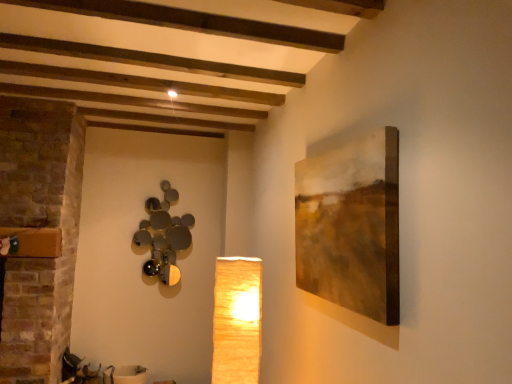
What do you see at coordinates (351, 226) in the screenshot?
I see `matte brown canvas at right` at bounding box center [351, 226].

Locate an element on the screen. metallic reflective spheres at upper left, positioned as the 1th lamp in left-to-right order is located at coordinates (164, 236).

Locate an element on the screen. matte yellow paper lampshade at center, the 1th lamp viewed from the right is located at coordinates (237, 320).

Does matte yellow paper lampshade at center, positioned as the 1th lamp in front-to-back order, have a lesser width compared to metallic reflective spheres at upper left, which ranks as the 1th lamp in back-to-front order?

No, matte yellow paper lampshade at center, positioned as the 1th lamp in front-to-back order, is not thinner than metallic reflective spheres at upper left, which ranks as the 1th lamp in back-to-front order.

Consider the image. Is matte yellow paper lampshade at center, the 1th lamp viewed from the right, facing towards metallic reflective spheres at upper left, which is counted as the second lamp, starting from the front?

No.

Between point (231, 308) and point (176, 216), which one is positioned in front?

Point (231, 308)

How many degrees apart are the facing directions of matte yellow paper lampshade at center, positioned as the 1th lamp in front-to-back order, and metallic reflective spheres at upper left, which ranks as the 1th lamp in back-to-front order?

92 degrees separate the facing orientations of matte yellow paper lampshade at center, positioned as the 1th lamp in front-to-back order, and metallic reflective spheres at upper left, which ranks as the 1th lamp in back-to-front order.

Does matte yellow paper lampshade at center, the second lamp viewed from the left, have a smaller size compared to matte brown canvas at right?

No.

The height and width of the screenshot is (384, 512). I want to click on picture frame lying in front of the matte yellow paper lampshade at center, the second lamp viewed from the left, so click(351, 226).

Is matte yellow paper lampshade at center, the second lamp viewed from the left, at the right side of matte brown canvas at right?

In fact, matte yellow paper lampshade at center, the second lamp viewed from the left, is to the left of matte brown canvas at right.

Based on their sizes in the image, would you say metallic reflective spheres at upper left, which ranks as the 1th lamp in back-to-front order, is bigger or smaller than matte brown canvas at right?

Considering their sizes, metallic reflective spheres at upper left, which ranks as the 1th lamp in back-to-front order, takes up less space than matte brown canvas at right.

Does metallic reflective spheres at upper left, which ranks as the 1th lamp in back-to-front order, appear on the right side of matte brown canvas at right?

In fact, metallic reflective spheres at upper left, which ranks as the 1th lamp in back-to-front order, is to the left of matte brown canvas at right.

Is metallic reflective spheres at upper left, positioned as the 1th lamp in left-to-right order, beside matte brown canvas at right?

They are not placed beside each other.

Is metallic reflective spheres at upper left, which is counted as the second lamp, starting from the front, taller than matte brown canvas at right?

Yes, metallic reflective spheres at upper left, which is counted as the second lamp, starting from the front, is taller than matte brown canvas at right.

In the scene shown: Is matte yellow paper lampshade at center, the second lamp viewed from the left, inside metallic reflective spheres at upper left, positioned as the 1th lamp in left-to-right order?

No, matte yellow paper lampshade at center, the second lamp viewed from the left, is not inside metallic reflective spheres at upper left, positioned as the 1th lamp in left-to-right order.

Between metallic reflective spheres at upper left, positioned as the 1th lamp in left-to-right order, and matte yellow paper lampshade at center, positioned as the 1th lamp in front-to-back order, which one has more height?

With more height is metallic reflective spheres at upper left, positioned as the 1th lamp in left-to-right order.

From the image's perspective, is metallic reflective spheres at upper left, marked as the second lamp in a right-to-left arrangement, located above or below matte yellow paper lampshade at center, the 1th lamp viewed from the right?

metallic reflective spheres at upper left, marked as the second lamp in a right-to-left arrangement, is situated higher than matte yellow paper lampshade at center, the 1th lamp viewed from the right, in the image.

Is matte brown canvas at right oriented towards metallic reflective spheres at upper left, which ranks as the 1th lamp in back-to-front order?

No, matte brown canvas at right does not turn towards metallic reflective spheres at upper left, which ranks as the 1th lamp in back-to-front order.

Measure the distance between matte brown canvas at right and metallic reflective spheres at upper left, which ranks as the 1th lamp in back-to-front order.

They are 7.93 feet apart.

Which is further, (309, 207) or (191, 219)?

The point (191, 219) is farther from the camera.

Would you say matte brown canvas at right is outside metallic reflective spheres at upper left, positioned as the 1th lamp in left-to-right order?

Yes, matte brown canvas at right is outside of metallic reflective spheres at upper left, positioned as the 1th lamp in left-to-right order.

Is matte brown canvas at right looking in the opposite direction of matte yellow paper lampshade at center, the 1th lamp viewed from the right?

No.

Considering the positions of objects matte brown canvas at right and matte yellow paper lampshade at center, the 1th lamp viewed from the right, in the image provided, who is in front, matte brown canvas at right or matte yellow paper lampshade at center, the 1th lamp viewed from the right,?

matte brown canvas at right is more forward.

Which of these two, matte brown canvas at right or matte yellow paper lampshade at center, positioned as the 1th lamp in front-to-back order, is thinner?

Thinner between the two is matte brown canvas at right.

How many degrees apart are the facing directions of matte brown canvas at right and matte yellow paper lampshade at center, the 1th lamp viewed from the right?

2.05 degrees.

Identify the location of lamp that is below the metallic reflective spheres at upper left, positioned as the 1th lamp in left-to-right order (from the image's perspective). This screenshot has height=384, width=512. (237, 320).

Locate an element on the screen. This screenshot has width=512, height=384. picture frame located above the matte yellow paper lampshade at center, the 1th lamp viewed from the right (from a real-world perspective) is located at coordinates (351, 226).

Consider the image. Based on their spatial positions, is matte yellow paper lampshade at center, the 1th lamp viewed from the right, or metallic reflective spheres at upper left, which is counted as the second lamp, starting from the front, closer to matte brown canvas at right?

Among the two, matte yellow paper lampshade at center, the 1th lamp viewed from the right, is located nearer to matte brown canvas at right.

In the scene shown: Looking at the image, which one is located closer to matte brown canvas at right, metallic reflective spheres at upper left, which ranks as the 1th lamp in back-to-front order, or matte yellow paper lampshade at center, the 1th lamp viewed from the right?

matte yellow paper lampshade at center, the 1th lamp viewed from the right, is closer to matte brown canvas at right.

From the image, which object appears to be farther from metallic reflective spheres at upper left, which ranks as the 1th lamp in back-to-front order, matte yellow paper lampshade at center, the second lamp viewed from the left, or matte brown canvas at right?

matte brown canvas at right is further to metallic reflective spheres at upper left, which ranks as the 1th lamp in back-to-front order.

Considering their positions, is metallic reflective spheres at upper left, which is counted as the second lamp, starting from the front, positioned closer to matte yellow paper lampshade at center, marked as the 2th lamp in a back-to-front arrangement, than matte brown canvas at right?

matte brown canvas at right is positioned closer to the anchor matte yellow paper lampshade at center, marked as the 2th lamp in a back-to-front arrangement.

Based on their spatial positions, is matte brown canvas at right or matte yellow paper lampshade at center, marked as the 2th lamp in a back-to-front arrangement, further from metallic reflective spheres at upper left, which ranks as the 1th lamp in back-to-front order?

Based on the image, matte brown canvas at right appears to be further to metallic reflective spheres at upper left, which ranks as the 1th lamp in back-to-front order.

Which object lies further to the anchor point matte yellow paper lampshade at center, the second lamp viewed from the left, matte brown canvas at right or metallic reflective spheres at upper left, which is counted as the second lamp, starting from the front?

Based on the image, metallic reflective spheres at upper left, which is counted as the second lamp, starting from the front, appears to be further to matte yellow paper lampshade at center, the second lamp viewed from the left.

You are a GUI agent. You are given a task and a screenshot of the screen. Output one action in this format:
    pyautogui.click(x=<x>, y=<y>)
    Task: Click on the lamp located between matte brown canvas at right and metallic reflective spheres at upper left, positioned as the 1th lamp in left-to-right order, in the depth direction
    The width and height of the screenshot is (512, 384).
    Given the screenshot: What is the action you would take?
    pyautogui.click(x=237, y=320)